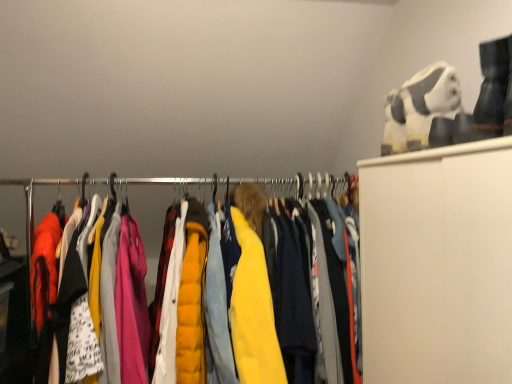
Question: Looking at their shapes, would you say yellow quilted jacket at center is wider or thinner than white plush toy at upper right?

Choices:
 (A) thin
 (B) wide

Answer: (B)

Question: From their relative heights in the image, would you say yellow quilted jacket at center is taller or shorter than white plush toy at upper right?

Choices:
 (A) tall
 (B) short

Answer: (A)

Question: Estimate the real-world distances between objects in this image. Which object is closer to the metallic hangers at center?

Choices:
 (A) white plush toy at upper right
 (B) yellow quilted jacket at center

Answer: (B)

Question: Which is nearer to the metallic hangers at center?

Choices:
 (A) yellow quilted jacket at center
 (B) white plush toy at upper right

Answer: (A)